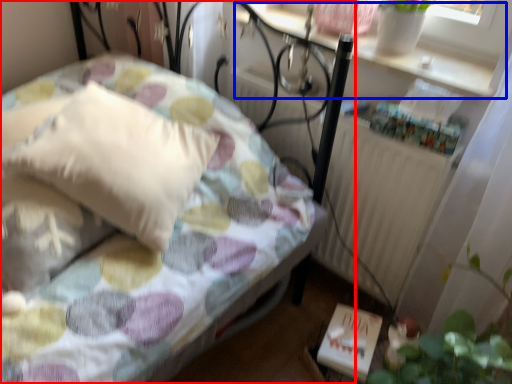
Question: Among these objects, which one is farthest to the camera, bed (highlighted by a red box) or window sill (highlighted by a blue box)?

Choices:
 (A) bed
 (B) window sill

Answer: (B)